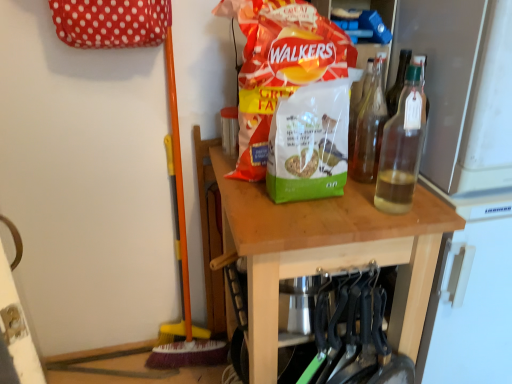
The image size is (512, 384). Identify the location of free region on the left part of clear glass bottle at upper right, which is the first bottle in front-to-back order. (331, 218).